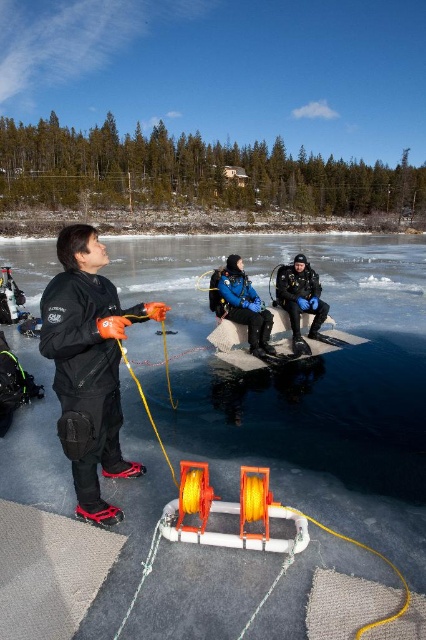
Is transparent ice at center thinner than black matte wetsuit at left?

No.

Based on the photo, between transparent ice at center and black matte wetsuit at left, which one appears on the left side from the viewer's perspective?

black matte wetsuit at left

Who is more forward, (396,438) or (85,360)?

Point (85,360) is in front.

Find the location of a particular element. This screenshot has width=426, height=640. transparent ice at center is located at coordinates (302, 365).

Can you confirm if transparent ice at center is positioned to the right of blue matte diving suit at center?

Yes, transparent ice at center is to the right of blue matte diving suit at center.

Is point (131, 243) positioned before point (255, 305)?

No, (131, 243) is further to viewer.

The width and height of the screenshot is (426, 640). Find the location of `transparent ice at center`. transparent ice at center is located at coordinates (302, 365).

Is black matte wetsuit at left bigger than blue diving suit at center?

Indeed, black matte wetsuit at left has a larger size compared to blue diving suit at center.

Is black matte wetsuit at left smaller than blue diving suit at center?

Actually, black matte wetsuit at left might be larger than blue diving suit at center.

Measure the distance between black matte wetsuit at left and camera.

They are 8.98 feet apart.

Locate an element on the screen. black matte wetsuit at left is located at coordinates (89, 365).